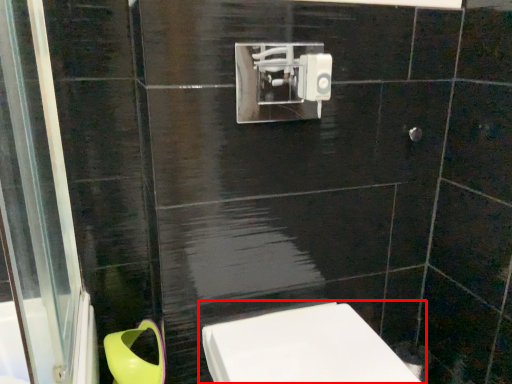
Question: From the image, what is the correct spatial relationship of toilet (annotated by the red box) in relation to toilet bowl?

Choices:
 (A) left
 (B) right

Answer: (B)